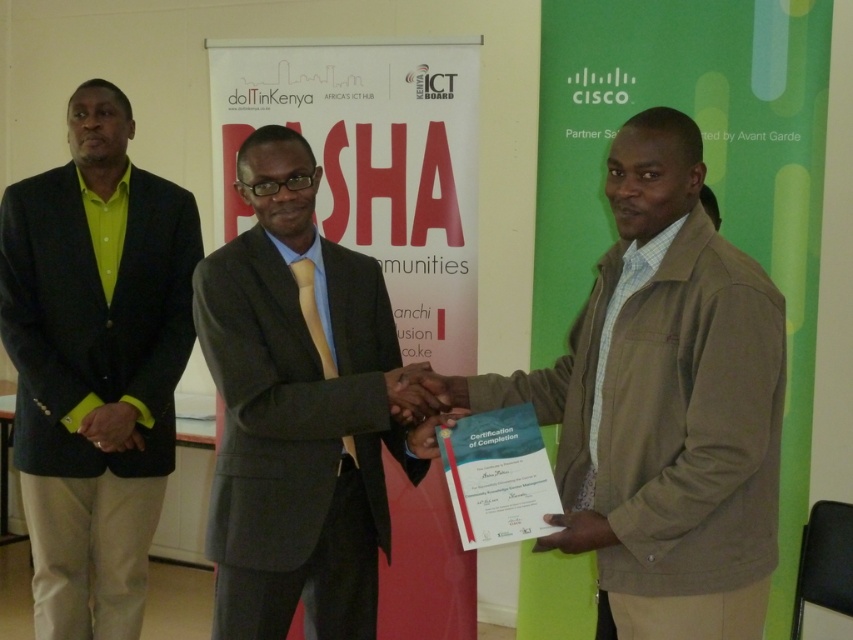
Does brown textured jacket at center have a smaller size compared to dark gray suit at center?

Actually, brown textured jacket at center might be larger than dark gray suit at center.

Between brown textured jacket at center and dark gray suit at center, which one is positioned lower?

dark gray suit at center is below.

Is point (669, 419) positioned behind point (291, 365)?

No, (669, 419) is in front of (291, 365).

This screenshot has width=853, height=640. Find the location of `brown textured jacket at center`. brown textured jacket at center is located at coordinates (662, 404).

Can you confirm if dark gray suit at center is wider than green matte blazer at left?

Indeed, dark gray suit at center has a greater width compared to green matte blazer at left.

Based on the photo, does dark gray suit at center have a greater height compared to green matte blazer at left?

In fact, dark gray suit at center may be shorter than green matte blazer at left.

Who is more distant from viewer, (x=372, y=332) or (x=148, y=298)?

Point (x=148, y=298)

The width and height of the screenshot is (853, 640). What are the coordinates of `dark gray suit at center` in the screenshot? It's located at (300, 410).

Does brown textured jacket at center have a greater width compared to green matte blazer at left?

Yes.

Does brown textured jacket at center appear on the right side of green matte blazer at left?

Indeed, brown textured jacket at center is positioned on the right side of green matte blazer at left.

Describe the element at coordinates (662, 404) in the screenshot. This screenshot has height=640, width=853. I see `brown textured jacket at center` at that location.

I want to click on brown textured jacket at center, so click(x=662, y=404).